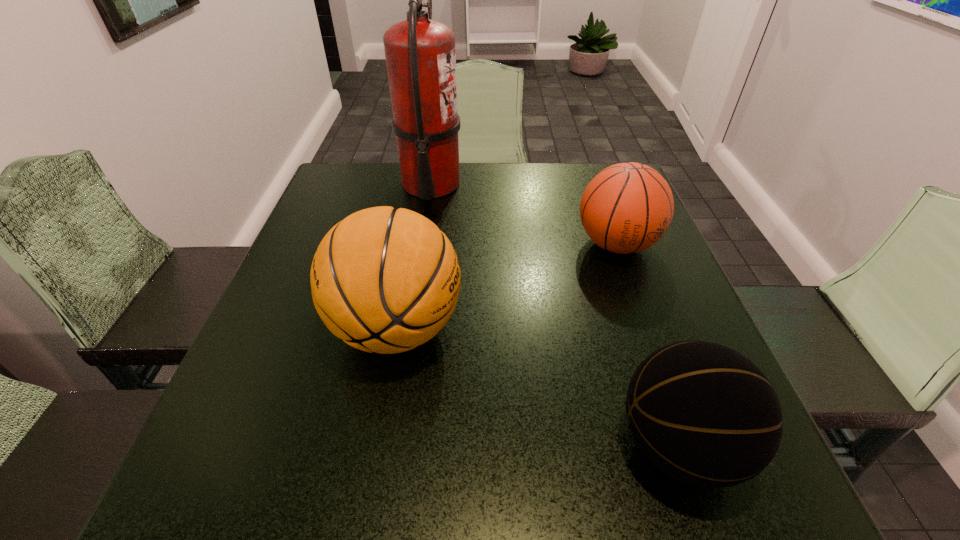
You are a GUI agent. You are given a task and a screenshot of the screen. Output one action in this format:
    pyautogui.click(x=<x>, y=<y>)
    Task: Click on the free space that is in between the second farthest object and the nearest basketball
    
    Given the screenshot: What is the action you would take?
    pyautogui.click(x=647, y=345)

I want to click on the second closest object to the nearest object, so click(626, 208).

You are a GUI agent. You are given a task and a screenshot of the screen. Output one action in this format:
    pyautogui.click(x=<x>, y=<y>)
    Task: Click on the third closest object to the nearest basketball
    This screenshot has height=540, width=960.
    Given the screenshot: What is the action you would take?
    coord(420,56)

Identify which basketball is the closest to the nearest basketball. Please provide its 2D coordinates. Your answer should be formatted as a tuple, i.e. [(x, y)], where the tuple contains the x and y coordinates of a point satisfying the conditions above.

[(384, 280)]

Locate an element on the screen. basketball that is the second closest to the fire extinguisher is located at coordinates (626, 208).

At what (x,y) coordinates should I click in order to perform the action: click on free region that satisfies the following two spatial constraints: 1. on the back side of the nearest basketball; 2. toward the nozzle of the fire extinguisher. Please return your answer as a coordinate pair (x, y). Looking at the image, I should click on pyautogui.click(x=589, y=184).

The image size is (960, 540). In order to click on free point that satisfies the following two spatial constraints: 1. on the back side of the nearest basketball; 2. toward the nozzle of the fire extinguisher in this screenshot , I will do `click(589, 184)`.

Where is `vacant position in the image that satisfies the following two spatial constraints: 1. toward the nozzle of the farthest basketball; 2. on the right side of the farthest object`? The height and width of the screenshot is (540, 960). vacant position in the image that satisfies the following two spatial constraints: 1. toward the nozzle of the farthest basketball; 2. on the right side of the farthest object is located at coordinates (422, 244).

At what (x,y) coordinates should I click in order to perform the action: click on vacant space that satisfies the following two spatial constraints: 1. toward the nozzle of the nearest basketball; 2. on the left side of the fire extinguisher. Please return your answer as a coordinate pair (x, y). Looking at the image, I should click on (392, 444).

This screenshot has height=540, width=960. I want to click on free space that satisfies the following two spatial constraints: 1. toward the nozzle of the tallest object; 2. on the right side of the nearest object, so click(x=392, y=444).